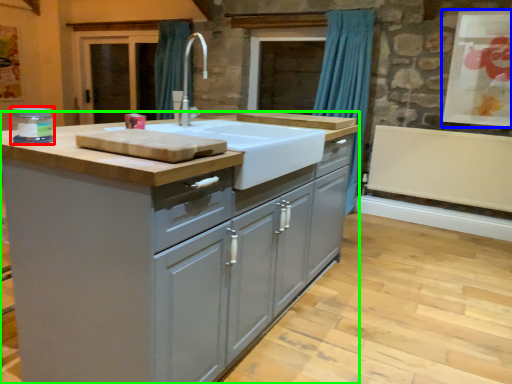
Question: Based on their relative distances, which object is farther from appliance (highlighted by a red box)? Choose from window screen (highlighted by a blue box) and cabinetry (highlighted by a green box).

Choices:
 (A) window screen
 (B) cabinetry

Answer: (A)